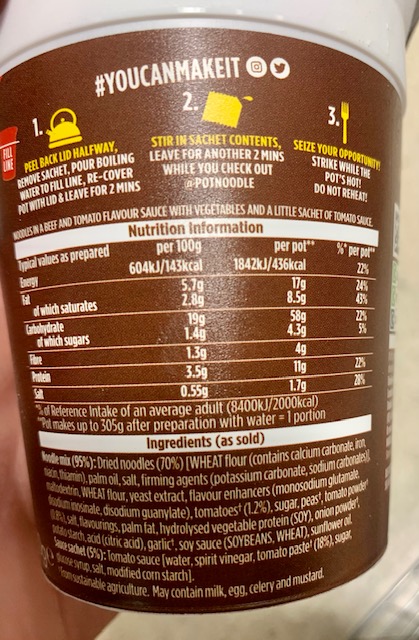
Locate an element on the screen. Image resolution: width=419 pixels, height=640 pixels. coffee pot is located at coordinates (66, 127).